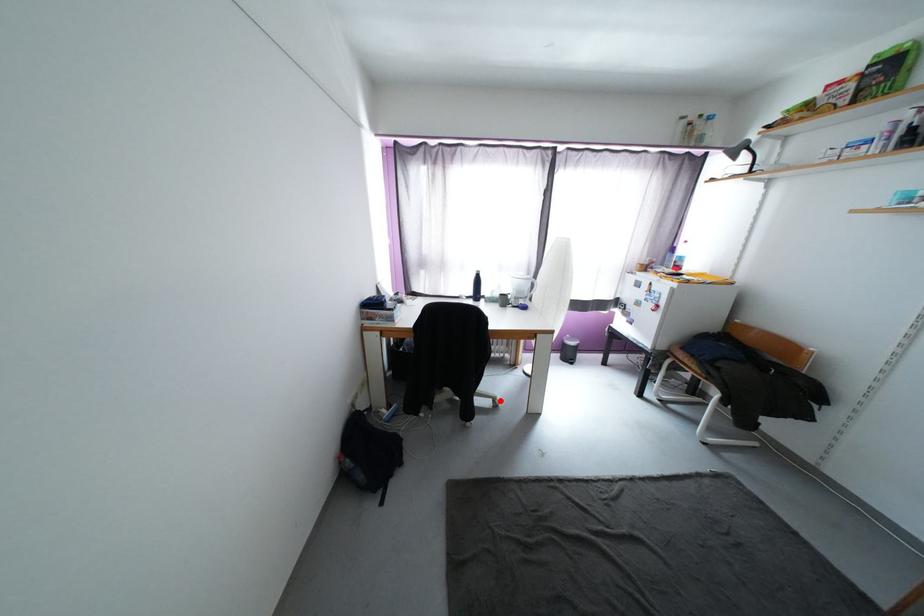
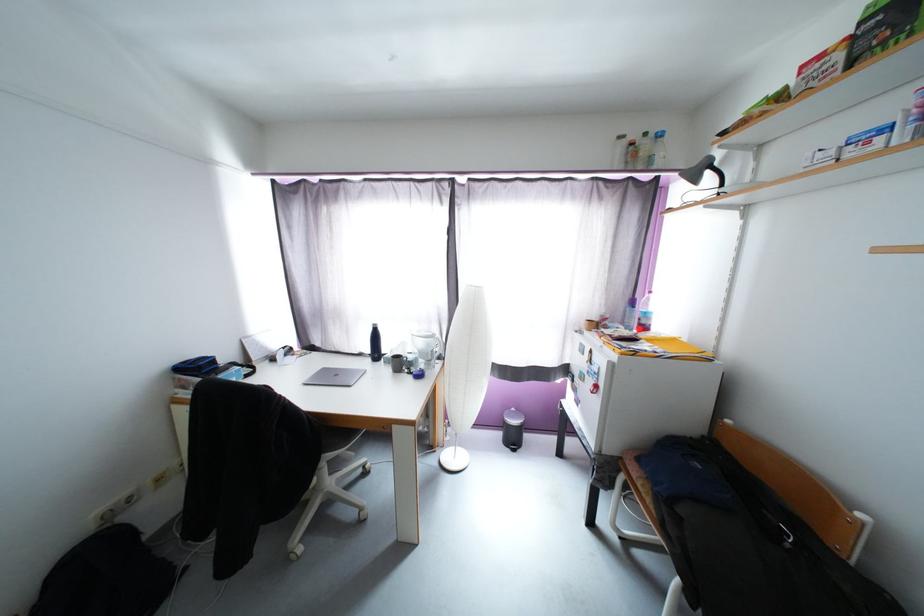
Locate, in the second image, the point that corresponds to the highlighted location in the first image.

(367, 511)